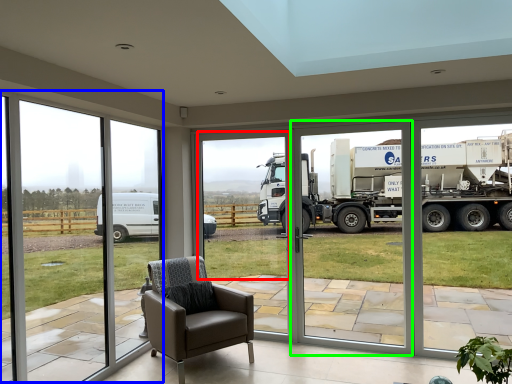
Question: Which object is positioned farthest from window screen (highlighted by a red box)? Select from window frame (highlighted by a blue box) and screen door (highlighted by a green box).

Choices:
 (A) window frame
 (B) screen door

Answer: (A)